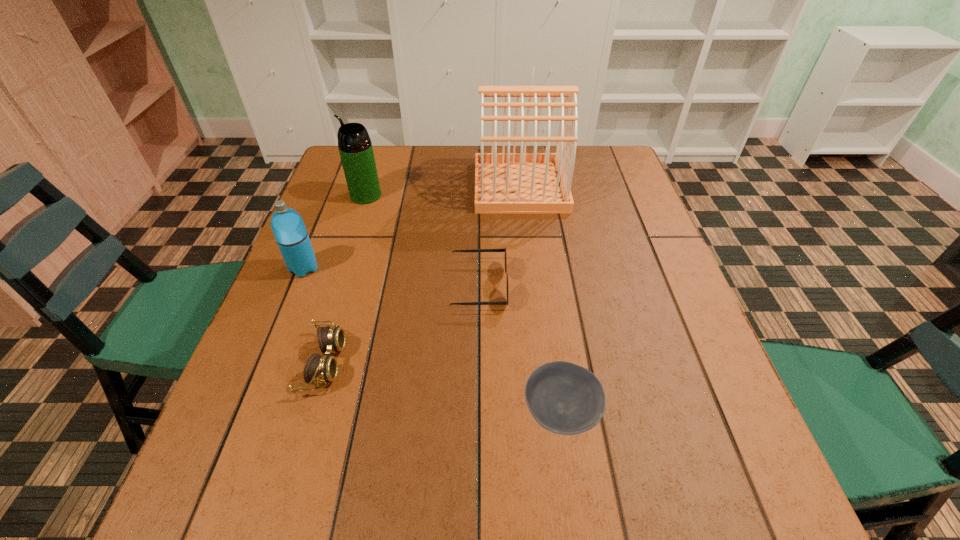
Locate an element on the screen. free space located 0.260m with an open door on the tallest object is located at coordinates pos(387,186).

Where is `free space located from the spout of the second tallest object`? free space located from the spout of the second tallest object is located at coordinates (329, 195).

The height and width of the screenshot is (540, 960). In order to click on vacant space located from the spout of the second tallest object in this screenshot , I will do `click(325, 195)`.

I want to click on vacant space located 0.160m on the front of the nearer thermos bottle, so click(x=277, y=333).

In order to click on vacant space located on the front-facing side of the sunglasses in this screenshot , I will do click(x=656, y=286).

Identify the location of vacant region located through the lenses of the goggles. The image size is (960, 540). (394, 363).

Find the location of `free space located 0.160m on the left of the bowl`. free space located 0.160m on the left of the bowl is located at coordinates (433, 412).

Where is `birdcage that is at the far edge`? birdcage that is at the far edge is located at coordinates (508, 182).

Image resolution: width=960 pixels, height=540 pixels. Find the location of `thermos bottle that is at the far edge`. thermos bottle that is at the far edge is located at coordinates (355, 147).

Where is `goggles that is at the left edge`? The height and width of the screenshot is (540, 960). goggles that is at the left edge is located at coordinates (318, 369).